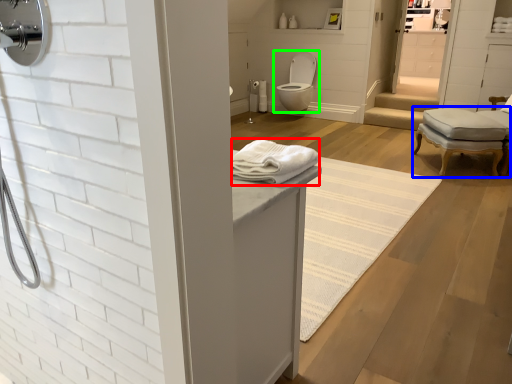
Question: Based on their relative distances, which object is nearer to bath towel (highlighted by a red box)? Choose from chair (highlighted by a blue box) and toilet (highlighted by a green box).

Choices:
 (A) chair
 (B) toilet

Answer: (A)